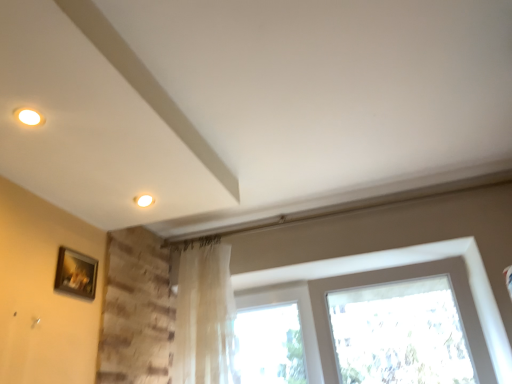
Question: Is translucent fabric curtain at center inside the boundaries of translucent fabric at center, or outside?

Choices:
 (A) inside
 (B) outside

Answer: (B)

Question: Is translucent fabric curtain at center taller or shorter than translucent fabric at center?

Choices:
 (A) tall
 (B) short

Answer: (A)

Question: Based on their relative distances, which object is nearer to the translucent fabric curtain at center?

Choices:
 (A) wooden picture frame at lower left
 (B) translucent fabric at center

Answer: (B)

Question: Which of these objects is positioned farthest from the wooden picture frame at lower left?

Choices:
 (A) translucent fabric at center
 (B) translucent fabric curtain at center

Answer: (A)